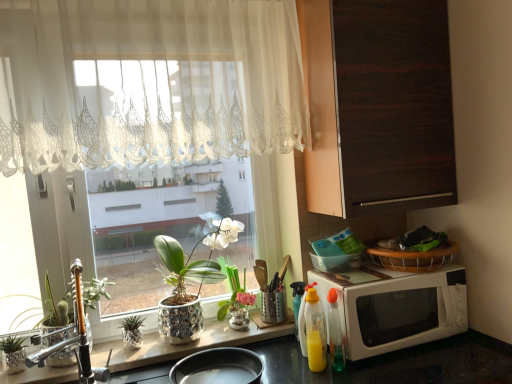
Locate an element on the screen. vacant space that is in between translucent glass pineapple at lower center, the 3th houseplant in the right-to-left sequence, and matte silver pot at center, the 1th houseplant when ordered from right to left is located at coordinates (187, 341).